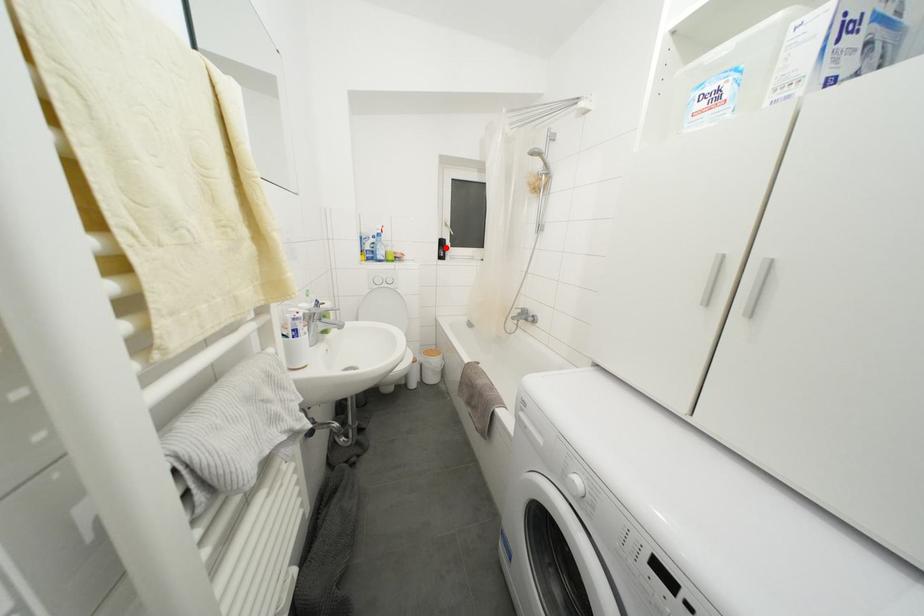
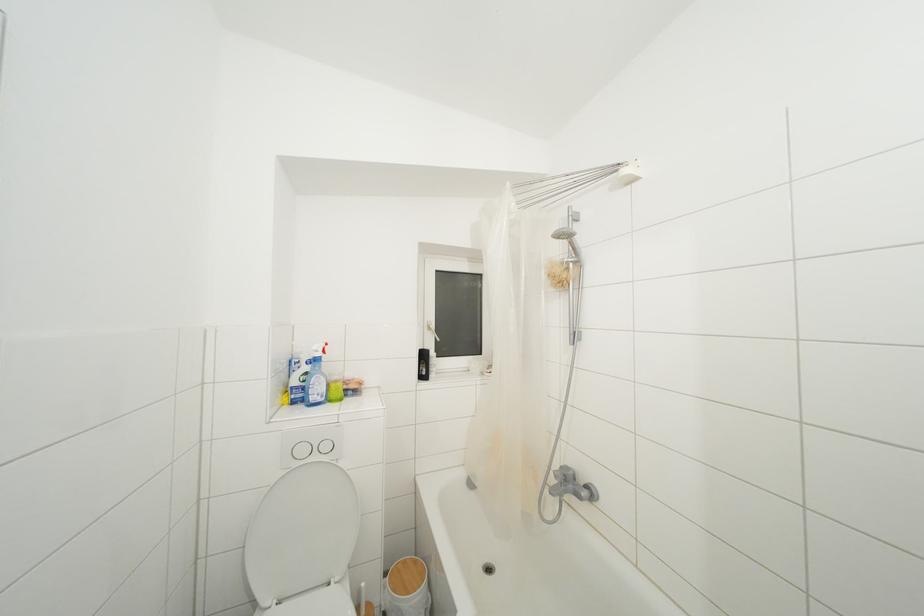
Locate, in the second image, the point that corresponds to the highlighted location in the first image.

(428, 361)